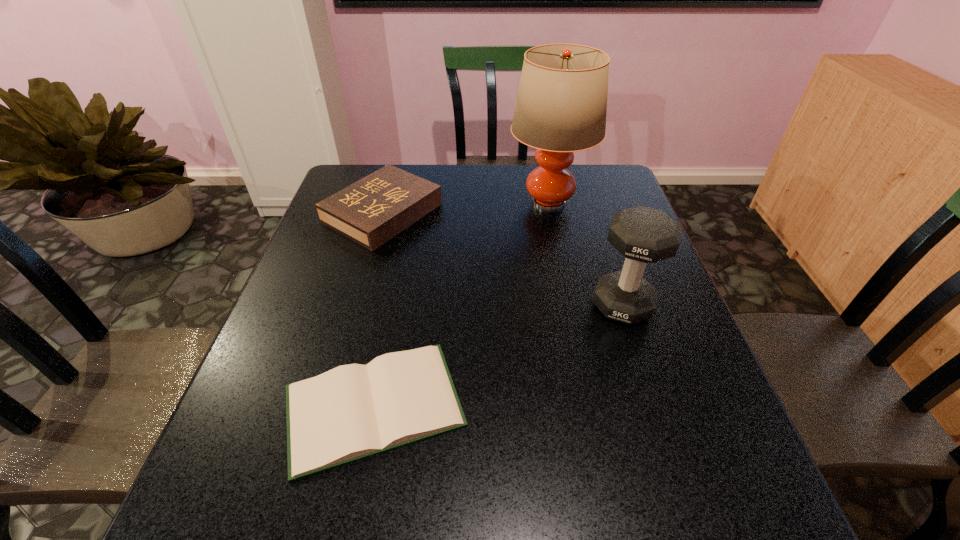
Identify the location of empty space between the taller hardback book and the dumbbell. The width and height of the screenshot is (960, 540). (502, 259).

The height and width of the screenshot is (540, 960). Identify the location of vacant area that lies between the second nearest object and the nearest object. (498, 356).

Locate an element on the screen. The height and width of the screenshot is (540, 960). free space between the dumbbell and the third tallest object is located at coordinates (502, 259).

Identify the location of the third closest object to the taller hardback book. (643, 235).

Locate an element on the screen. object that stands as the closest to the farther hardback book is located at coordinates (561, 105).

At what (x,y) coordinates should I click in order to perform the action: click on vacant space that satisfies the following two spatial constraints: 1. on the back side of the shortest object; 2. on the left side of the third shortest object. Please return your answer as a coordinate pair (x, y). The image size is (960, 540). Looking at the image, I should click on (394, 305).

Locate an element on the screen. This screenshot has height=540, width=960. vacant space that satisfies the following two spatial constraints: 1. on the front side of the farther hardback book; 2. on the right side of the nearer hardback book is located at coordinates (328, 406).